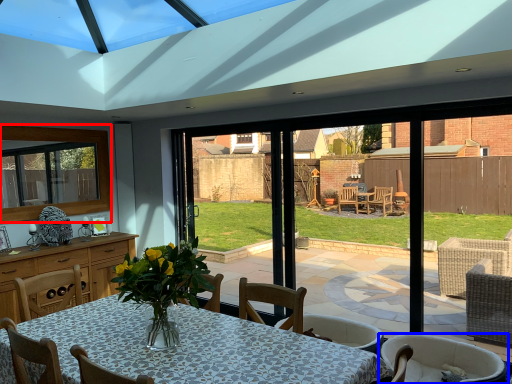
Question: Which of the following is the closest to the observer, window (highlighted by a red box) or chair (highlighted by a blue box)?

Choices:
 (A) window
 (B) chair

Answer: (B)